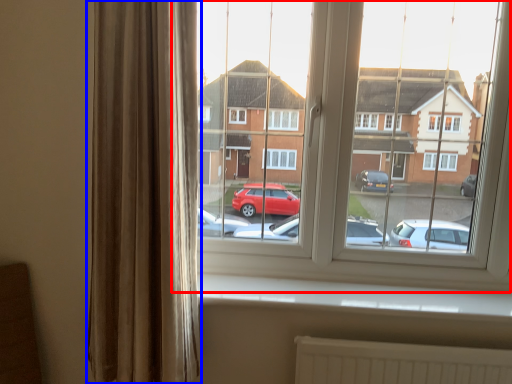
Question: Which point is further to the camera, window (highlighted by a red box) or curtain (highlighted by a blue box)?

Choices:
 (A) window
 (B) curtain

Answer: (A)